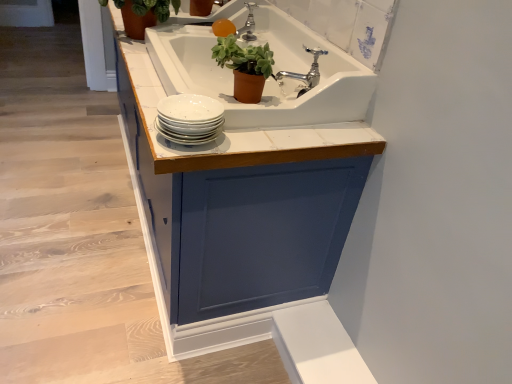
Find the location of a particular element. The height and width of the screenshot is (384, 512). free location to the right of green matte plant pot at upper center, arranged as the 2th houseplant when viewed from the left is located at coordinates (312, 130).